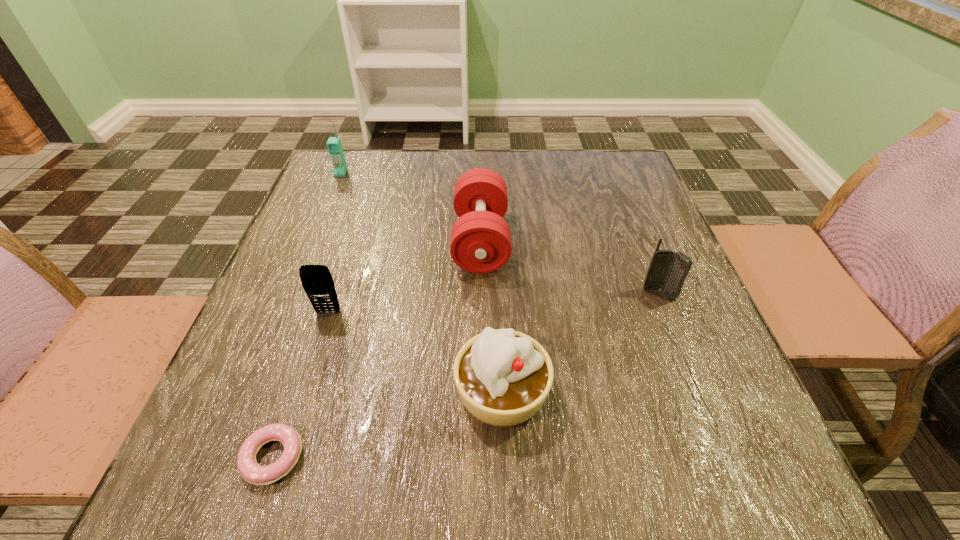
The width and height of the screenshot is (960, 540). In order to click on the leftmost cellular telephone in this screenshot , I will do `click(334, 145)`.

Where is `the farthest cellular telephone`? The width and height of the screenshot is (960, 540). the farthest cellular telephone is located at coordinates (334, 145).

Locate an element on the screen. the second nearest cellular telephone is located at coordinates coord(667,270).

Image resolution: width=960 pixels, height=540 pixels. I want to click on the rightmost object, so click(667, 270).

At what (x,y) coordinates should I click in order to perform the action: click on the second farthest object. Please return your answer as a coordinate pair (x, y). The height and width of the screenshot is (540, 960). Looking at the image, I should click on (480, 243).

The height and width of the screenshot is (540, 960). Find the location of `the fourth farthest object`. the fourth farthest object is located at coordinates (317, 281).

At what (x,y) coordinates should I click in order to perform the action: click on the second cellular telephone from left to right. Please return your answer as a coordinate pair (x, y). This screenshot has height=540, width=960. Looking at the image, I should click on (317, 281).

Where is `whipped cream`? whipped cream is located at coordinates (503, 377).

Where is `the shortest object`? the shortest object is located at coordinates (249, 469).

Where is `blank area located 0.320m on the keypad of the farthest cellular telephone`? This screenshot has width=960, height=540. blank area located 0.320m on the keypad of the farthest cellular telephone is located at coordinates (306, 258).